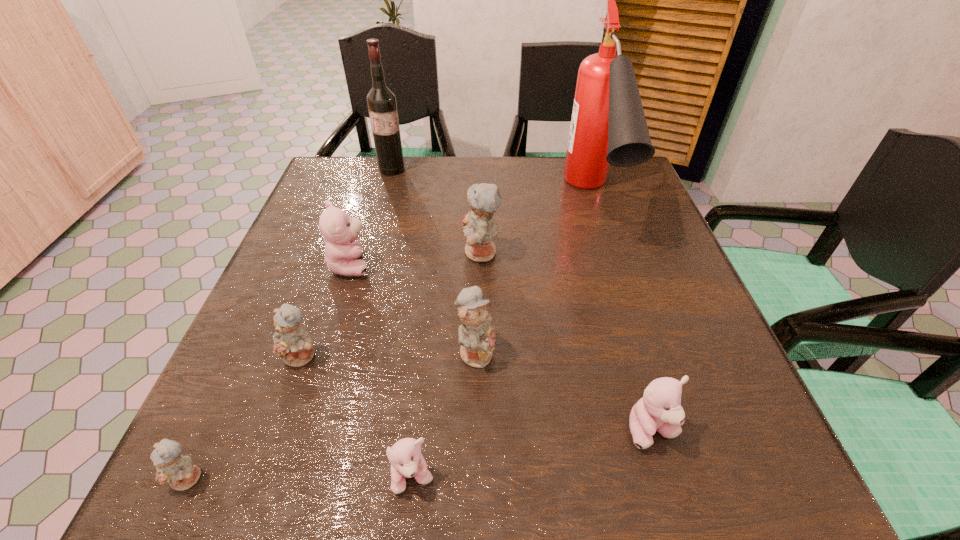
In order to click on vacant region located at the face of the farthest pink teddy bear in this screenshot , I will do `click(524, 265)`.

Find the location of a particular element. Image resolution: width=960 pixels, height=540 pixels. vacant region located 0.390m on the front-facing side of the second biggest blue teddy bear is located at coordinates (712, 351).

Locate an element on the screen. vacant space located 0.210m on the front-facing side of the third biggest blue teddy bear is located at coordinates (252, 497).

Locate an element on the screen. free space located 0.060m at the face of the second farthest pink teddy bear is located at coordinates (x=672, y=496).

Locate an element on the screen. Image resolution: width=960 pixels, height=540 pixels. fire extinguisher located at the far edge is located at coordinates (608, 126).

Locate an element on the screen. This screenshot has width=960, height=540. wine bottle located at the far edge is located at coordinates (381, 101).

The image size is (960, 540). Identify the location of wine bottle that is at the left edge. (381, 101).

Image resolution: width=960 pixels, height=540 pixels. I want to click on fire extinguisher that is at the right edge, so click(608, 126).

I want to click on teddy bear positioned at the right edge, so click(659, 409).

This screenshot has width=960, height=540. Identify the location of object located in the far left corner section of the desktop. (381, 101).